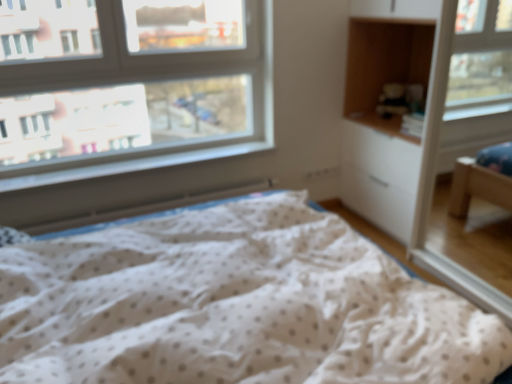
Question: In the image, is white plastic window sill at lower left on the left side or the right side of clear glass window at upper left?

Choices:
 (A) left
 (B) right

Answer: (B)

Question: Looking at their shapes, would you say white plastic window sill at lower left is wider or thinner than clear glass window at upper left?

Choices:
 (A) wide
 (B) thin

Answer: (A)

Question: Based on their relative distances, which object is nearer to the white plastic window sill at lower left?

Choices:
 (A) clear glass window at upper left
 (B) white dotted fabric at center
 (C) white plastic radiator at lower left
 (D) wooden cabinet at upper right

Answer: (C)

Question: Considering the real-world distances, which object is closest to the wooden cabinet at upper right?

Choices:
 (A) white plastic radiator at lower left
 (B) clear glass window at upper left
 (C) white plastic window sill at lower left
 (D) white dotted fabric at center

Answer: (B)